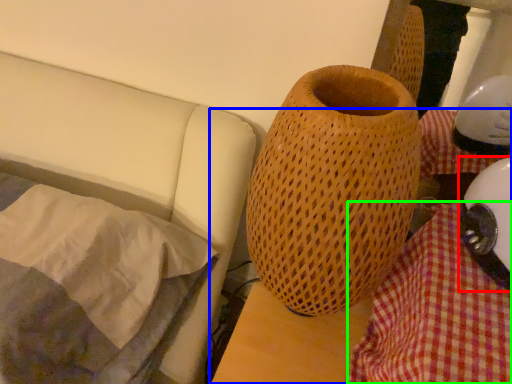
Question: Which object is positioned farthest from helmet (highlighted by a red box)? Select from table (highlighted by a blue box) and blanket (highlighted by a green box).

Choices:
 (A) table
 (B) blanket

Answer: (A)